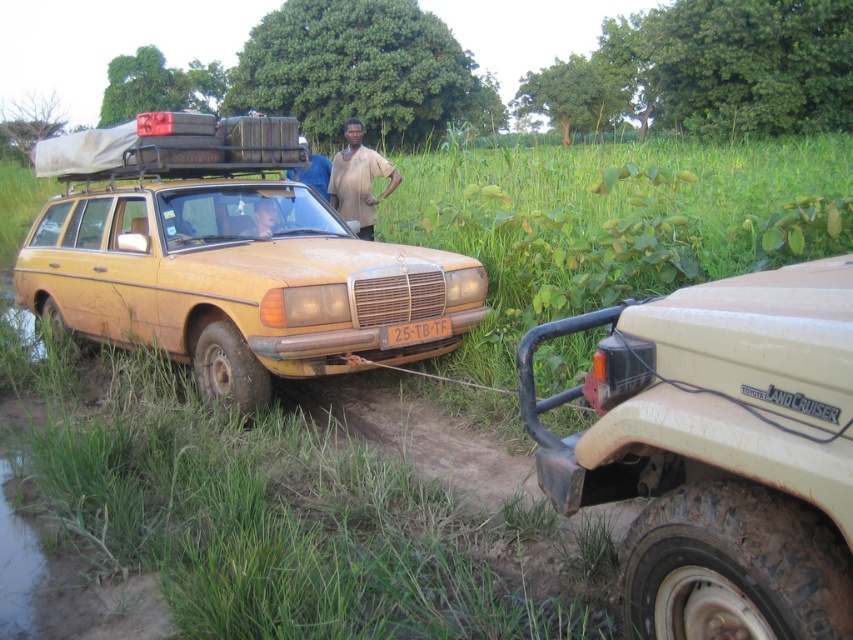
Is beige matte/rough toyota landcruiser at right thinner than rusty matte station wagon at center?

Yes.

Who is more forward, (671, 435) or (328, 355)?

Point (671, 435) is more forward.

Between point (604, 317) and point (270, 317), which one is positioned in front?

Point (604, 317) is in front.

Image resolution: width=853 pixels, height=640 pixels. What are the coordinates of `beige matte/rough toyota landcruiser at right` in the screenshot? It's located at (718, 451).

Does beige matte/rough toyota landcruiser at right appear under blue fabric shirt at center?

Indeed, beige matte/rough toyota landcruiser at right is positioned under blue fabric shirt at center.

Who is taller, beige matte/rough toyota landcruiser at right or blue fabric shirt at center?

blue fabric shirt at center is taller.

Does point (621, 376) lie in front of point (326, 168)?

Yes.

The height and width of the screenshot is (640, 853). Find the location of `beige matte/rough toyota landcruiser at right`. beige matte/rough toyota landcruiser at right is located at coordinates point(718,451).

Locate an element on the screen. blue fabric shirt at center is located at coordinates (312, 170).

At what (x,y) coordinates should I click in order to perform the action: click on blue fabric shirt at center. Please return your answer as a coordinate pair (x, y). This screenshot has width=853, height=640. Looking at the image, I should click on (312, 170).